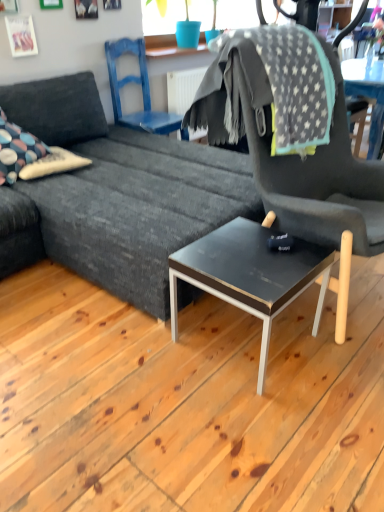
Question: Is gray star-patterned blanket at upper right in front of or behind black glossy coffee table at center in the image?

Choices:
 (A) front
 (B) behind

Answer: (B)

Question: Based on their sizes in the image, would you say gray star-patterned blanket at upper right is bigger or smaller than black glossy coffee table at center?

Choices:
 (A) small
 (B) big

Answer: (B)

Question: Which object is positioned closest to the multicolored fabric pillow at left?

Choices:
 (A) black glossy coffee table at center
 (B) gray star-patterned blanket at upper right
 (C) dark gray fabric couch at center
 (D) dark gray fabric chair at center, which appears as the 2th chair when viewed from the back
 (E) blue painted wood chair at upper center, which is counted as the first chair, starting from the back

Answer: (C)

Question: Estimate the real-world distances between objects in this image. Which object is farther from the dark gray fabric chair at center, which appears as the 2th chair when viewed from the back?

Choices:
 (A) multicolored fabric pillow at left
 (B) black glossy coffee table at center
 (C) gray star-patterned blanket at upper right
 (D) dark gray fabric couch at center
 (E) blue painted wood chair at upper center, which is counted as the first chair, starting from the back

Answer: (E)